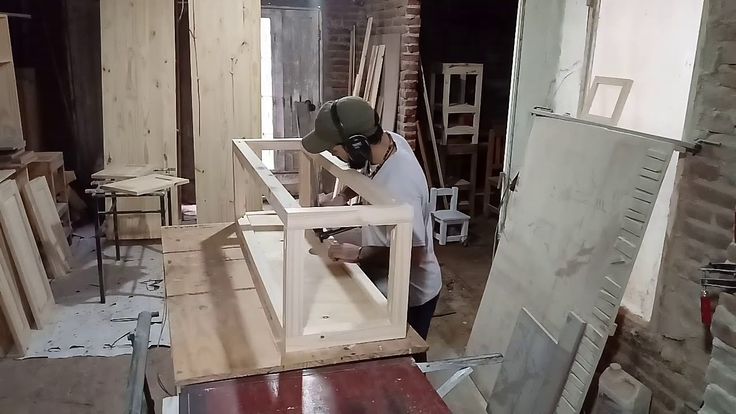
You are a GUI agent. You are given a task and a screenshot of the screen. Output one action in this format:
    pyautogui.click(x=<x>, y=<y>)
    Task: Click on the wood floor
    
    Given the screenshot: What is the action you would take?
    pyautogui.click(x=73, y=388), pyautogui.click(x=472, y=270)